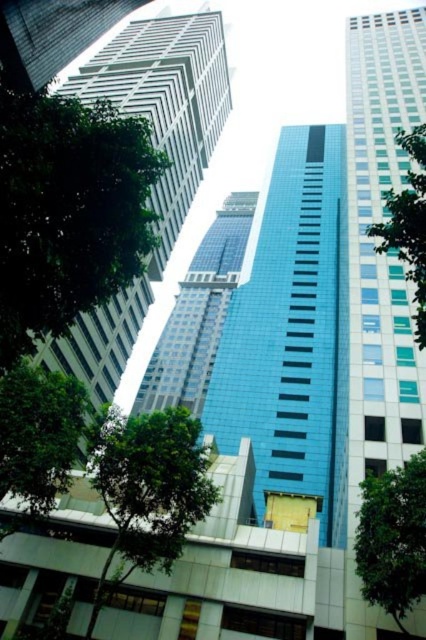
Does point (109, 433) come closer to viewer compared to point (399, 225)?

No, (109, 433) is further to viewer.

Does point (169, 467) come behind point (420, 252)?

Yes, point (169, 467) is farther from viewer.

Identify the location of green leafy tree at center. This screenshot has width=426, height=640. (147, 490).

Is blue glassy tower at center below green leafy tree at lower right?

No, blue glassy tower at center is not below green leafy tree at lower right.

Is blue glassy tower at center bigger than green leafy tree at lower right?

Correct, blue glassy tower at center is larger in size than green leafy tree at lower right.

Between point (226, 266) and point (396, 540), which one is positioned behind?

The point (226, 266) is behind.

The image size is (426, 640). Find the location of `blue glassy tower at center`. blue glassy tower at center is located at coordinates (198, 314).

Between blue glassy tower at center and green leafy tree at right, which one appears on the left side from the viewer's perspective?

blue glassy tower at center

Can you confirm if blue glassy tower at center is thinner than green leafy tree at right?

In fact, blue glassy tower at center might be wider than green leafy tree at right.

Between point (218, 244) and point (419, 180), which one is positioned behind?

The point (218, 244) is behind.

Locate an element on the screen. Image resolution: width=426 pixels, height=640 pixels. blue glassy tower at center is located at coordinates (198, 314).